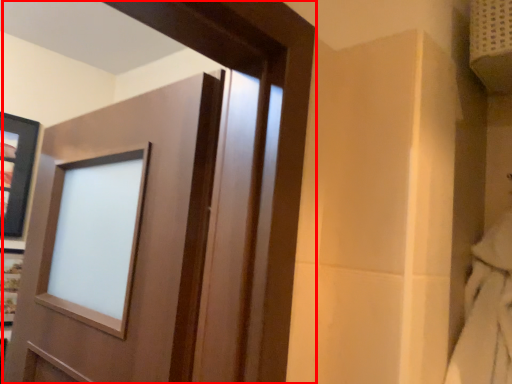
Question: From the image, what is the correct spatial relationship of door (annotated by the red box) in relation to picture frame?

Choices:
 (A) right
 (B) left

Answer: (A)